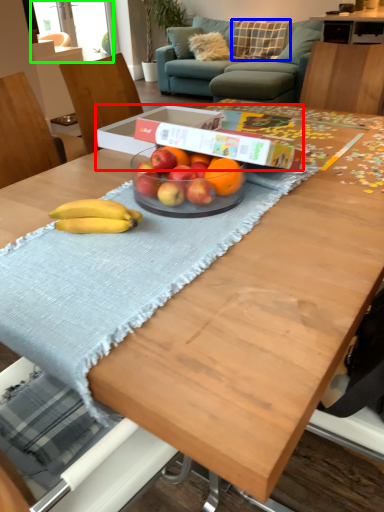
Question: Estimate the real-world distances between objects in this image. Which object is farther from cardboard box (highlighted by a red box), pillow (highlighted by a blue box) or window screen (highlighted by a green box)?

Choices:
 (A) pillow
 (B) window screen

Answer: (A)